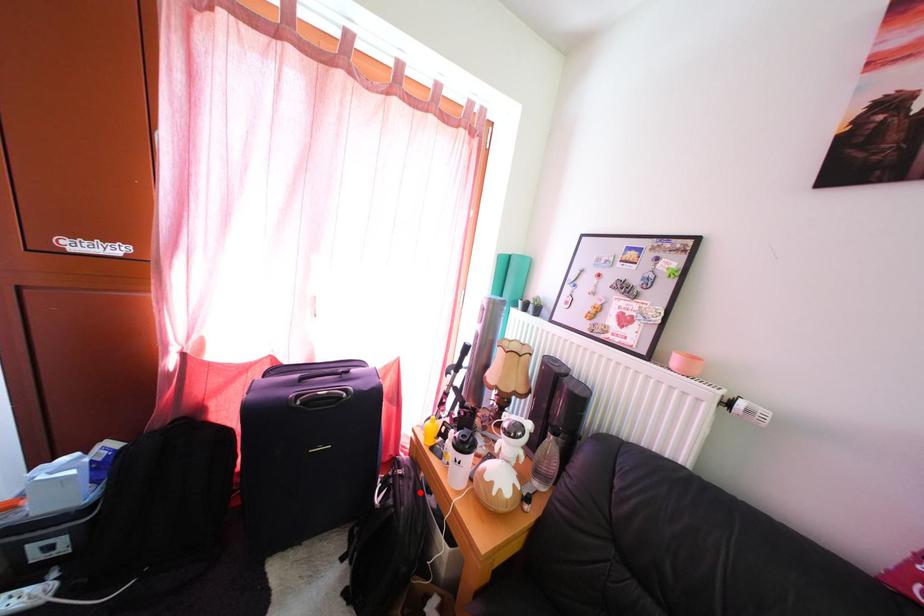
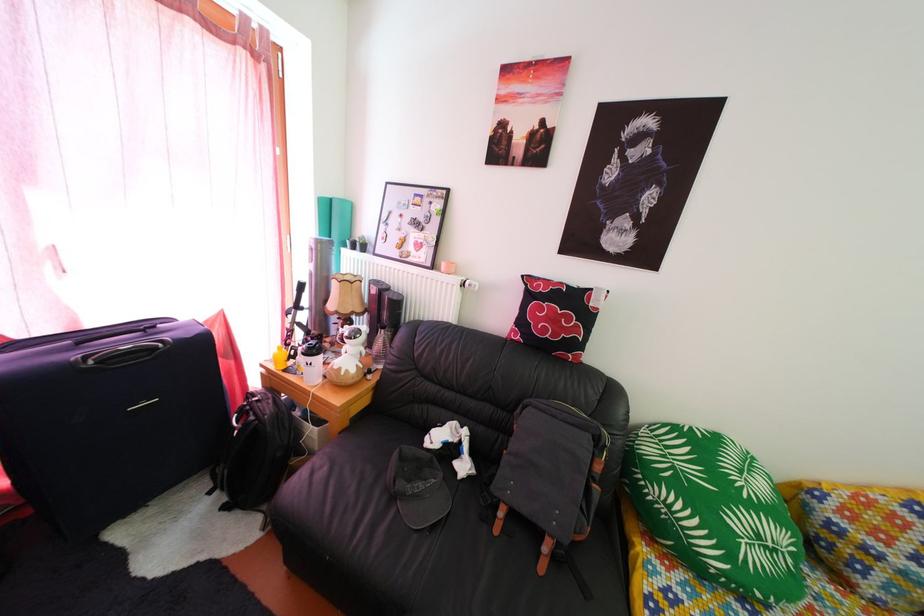
Where in the second image is the point corresponding to the highlighted location from the first image?

(280, 410)